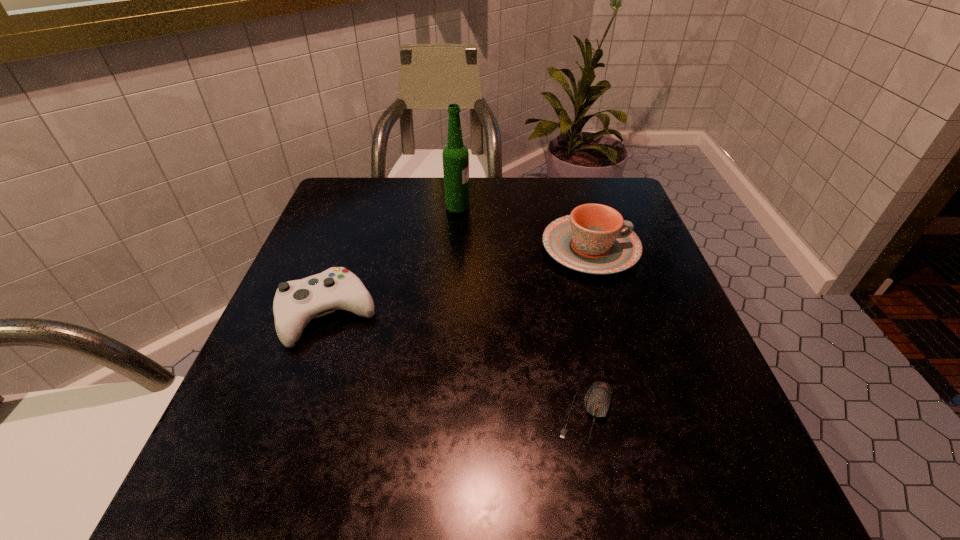
Locate an element on the screen. This screenshot has height=540, width=960. free region located on the left of the nearest object is located at coordinates (474, 413).

What are the coordinates of `beer bottle at the far edge` in the screenshot? It's located at (455, 155).

Locate an element on the screen. The image size is (960, 540). chinaware that is at the far edge is located at coordinates (594, 239).

Where is `object present at the left edge`? object present at the left edge is located at coordinates (296, 303).

I want to click on object located in the right edge section of the desktop, so click(x=594, y=239).

Locate an element on the screen. The image size is (960, 540). object located at the far right corner is located at coordinates pos(594,239).

In the image, there is a desktop. Identify the location of blank space at the far edge. Image resolution: width=960 pixels, height=540 pixels. (448, 210).

You are a GUI agent. You are given a task and a screenshot of the screen. Output one action in this format:
    pyautogui.click(x=<x>, y=<y>)
    Task: Click on the vacant space at the left edge
    This screenshot has height=540, width=960.
    Given the screenshot: What is the action you would take?
    pyautogui.click(x=296, y=386)

In the image, there is a desktop. Where is `free space at the right edge`? free space at the right edge is located at coordinates (636, 312).

Where is `vacant space at the near left corner of the desktop`? The height and width of the screenshot is (540, 960). vacant space at the near left corner of the desktop is located at coordinates (241, 456).